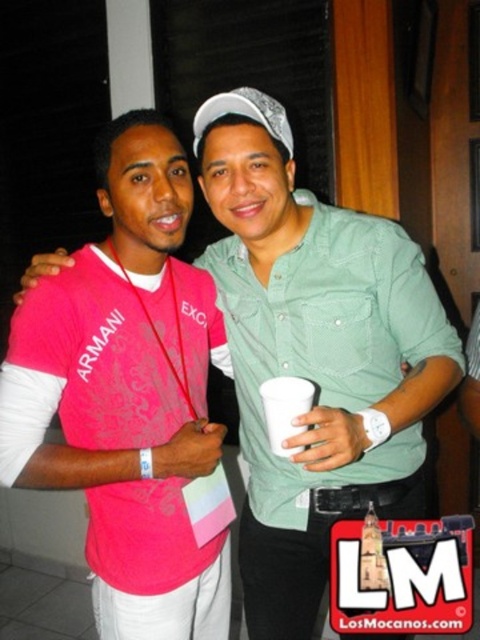
What do you see at coordinates (128, 394) in the screenshot? I see `pink fabric shirt at center` at bounding box center [128, 394].

From the picture: Does pink fabric shirt at center appear on the left side of white paper cup at center?

Indeed, pink fabric shirt at center is positioned on the left side of white paper cup at center.

Where is `pink fabric shirt at center`? Image resolution: width=480 pixels, height=640 pixels. pink fabric shirt at center is located at coordinates (128, 394).

Locate an element on the screen. pink fabric shirt at center is located at coordinates (128, 394).